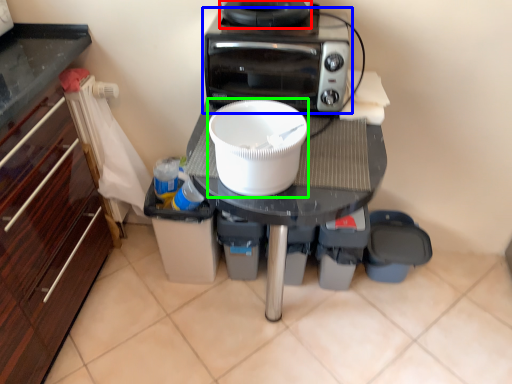
Question: Based on their relative distances, which object is nearer to appliance (highlighted by a red box)? Choose from home appliance (highlighted by a blue box) and kitchen appliance (highlighted by a green box).

Choices:
 (A) home appliance
 (B) kitchen appliance

Answer: (A)